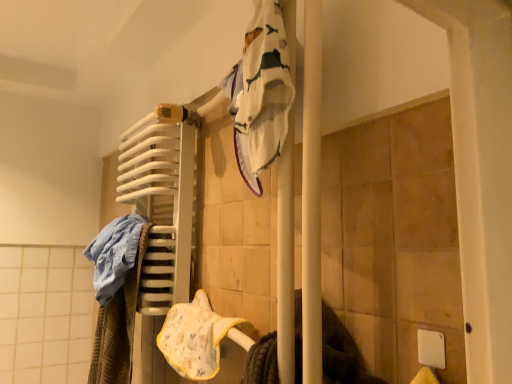
The height and width of the screenshot is (384, 512). What do you see at coordinates (198, 338) in the screenshot?
I see `printed cotton bib at lower center` at bounding box center [198, 338].

Locate an element on the screen. This screenshot has width=512, height=384. printed cotton bib at lower center is located at coordinates (198, 338).

What is the approximate width of printed cotton bib at lower center?

printed cotton bib at lower center is 4.60 inches in width.

Where is `printed cotton bib at lower center`? This screenshot has height=384, width=512. printed cotton bib at lower center is located at coordinates click(x=198, y=338).